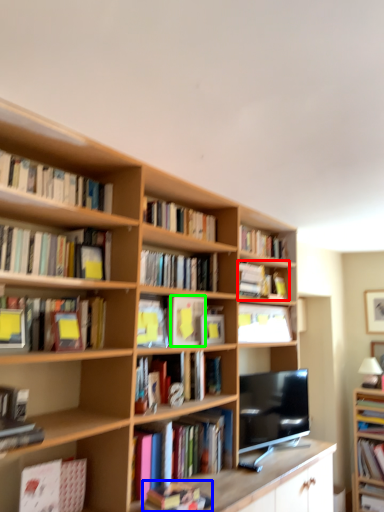
Question: Which object is positioned closest to book (highlighted by a red box)? Select from book (highlighted by a blue box) and paperback book (highlighted by a green box).

Choices:
 (A) book
 (B) paperback book

Answer: (B)